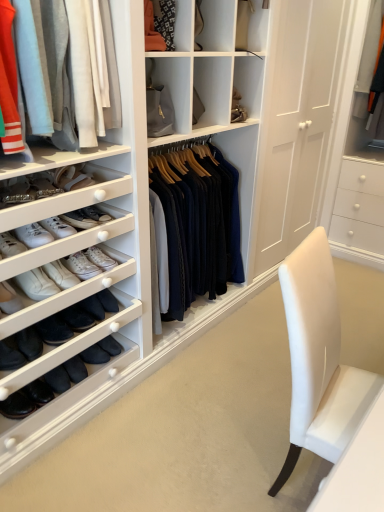
Question: From a real-world perspective, relative to matte orange fabric at upper center, is white leather sneakers at left vertically above or below?

Choices:
 (A) above
 (B) below

Answer: (B)

Question: Considering the positions of white leather sneakers at left and matte orange fabric at upper center in the image, is white leather sneakers at left taller or shorter than matte orange fabric at upper center?

Choices:
 (A) tall
 (B) short

Answer: (B)

Question: Based on their relative distances, which object is nearer to the white leather sneakers at left?

Choices:
 (A) matte orange fabric at upper center
 (B) light gray cotton pants at upper left

Answer: (B)

Question: Considering the real-world distances, which object is farthest from the light gray cotton pants at upper left?

Choices:
 (A) white leather sneakers at left
 (B) matte orange fabric at upper center

Answer: (B)